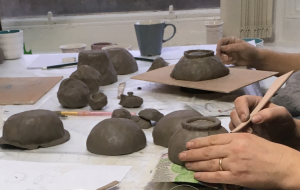
I want to click on curtains, so click(x=251, y=18).